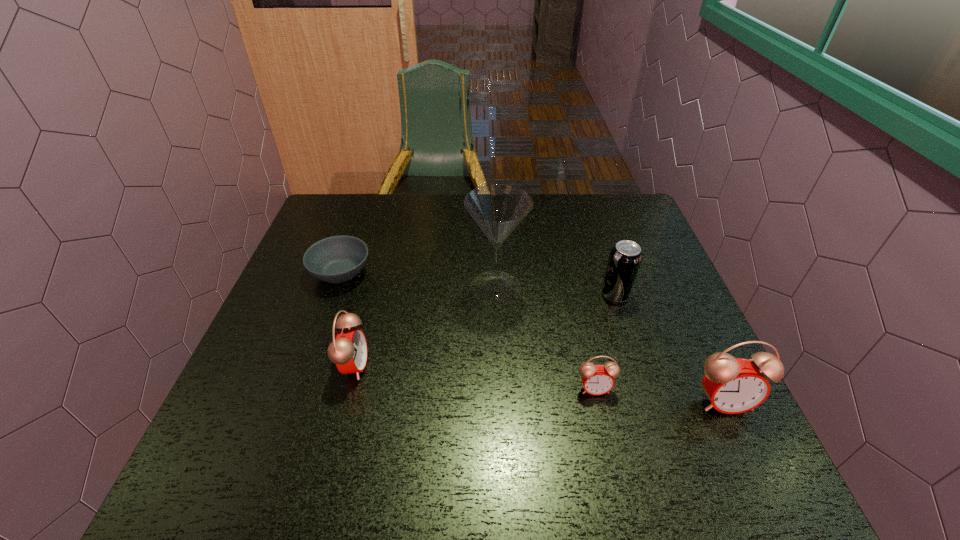
The height and width of the screenshot is (540, 960). What are the coordinates of `vacant space at the left edge` in the screenshot? It's located at (275, 312).

This screenshot has width=960, height=540. Find the location of `vacant space at the far right corner`. vacant space at the far right corner is located at coordinates (597, 236).

Find the location of a particular element. The image size is (960, 540). free region at the near right corner of the desktop is located at coordinates (681, 423).

I want to click on vacant point located between the tallest object and the soda can, so click(556, 291).

At what (x,y) coordinates should I click in order to perform the action: click on free space that is in between the second alarm clock from left to right and the second tallest alarm clock. Please return your answer as a coordinate pair (x, y). Image resolution: width=960 pixels, height=540 pixels. Looking at the image, I should click on (474, 377).

Image resolution: width=960 pixels, height=540 pixels. What are the coordinates of `vacant space that is in between the shortest alarm clock and the leftmost alarm clock` in the screenshot? It's located at (474, 377).

Where is `unoccupied position between the second alarm clock from left to right and the rightmost alarm clock`? This screenshot has width=960, height=540. unoccupied position between the second alarm clock from left to right and the rightmost alarm clock is located at coordinates (660, 395).

Locate an element on the screen. The width and height of the screenshot is (960, 540). free space between the tallest object and the second shortest alarm clock is located at coordinates (425, 326).

The width and height of the screenshot is (960, 540). I want to click on free area in between the shortest alarm clock and the second shortest alarm clock, so click(x=474, y=377).

At what (x,y) coordinates should I click in order to perform the action: click on empty location between the shortest object and the second alarm clock from right to left. Please return your answer as a coordinate pair (x, y). This screenshot has height=540, width=960. Looking at the image, I should click on (468, 330).